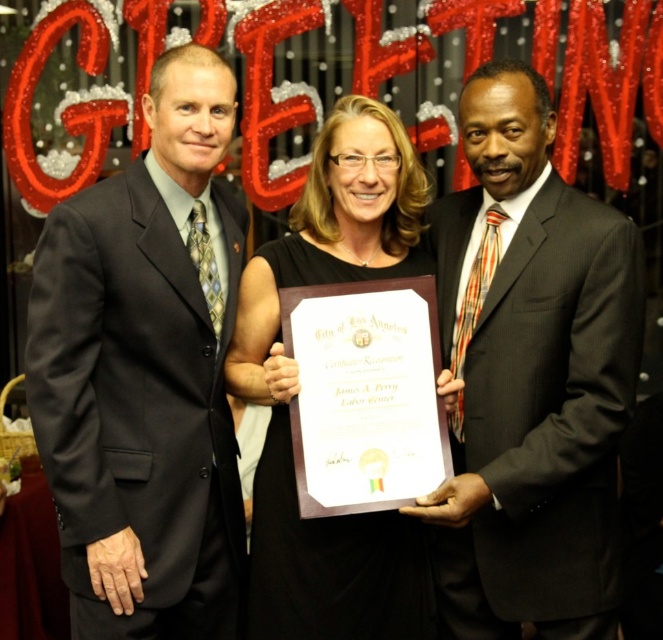
You are a photographer at the event and want to adjust the lighting so that the matte black suit at left and the matte black suit at center are equally illuminated. Which one should you move closer to the light source?

The matte black suit at left is in front of matte black suit at center, so you should move the matte black suit at center closer to the light source to ensure both are equally illuminated.

You are a photographer at a formal event where two men are standing. You notice the matte black suit at left and the matte black suit at center. Which one is closer to the camera?

The matte black suit at left is closer to the camera because it is positioned over the matte black suit at center.

You are a photographer trying to adjust the lighting for the central figure wearing the matte black suit at center. Based on their position at coordinates point 0.591, 0.801, where should you direct the spotlight to ensure it illuminates them properly?

The matte black suit at center is located at point (530, 378), so the spotlight should be directed towards that coordinate to effectively illuminate the central figure wearing the matte black suit at center.